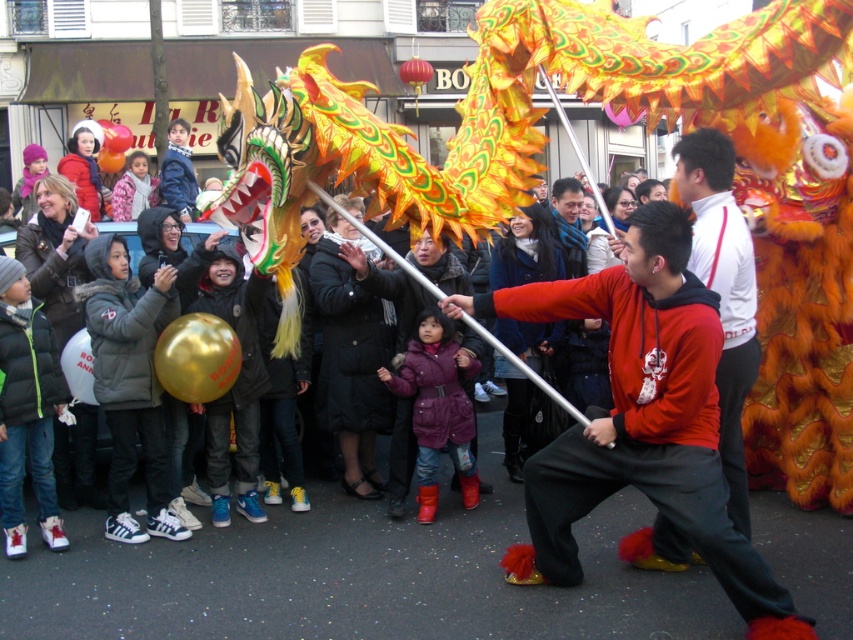
You are a photographer standing at the edge of the crowd, trying to capture a clear photo of the dragon. You notice two people in red clothing at the center of the scene. Which person, the one wearing the matte red sweatshirt at center or the red hoodie at center, is shorter and might allow you to get a better shot without blocking the dragon?

The matte red sweatshirt at center is shorter in height compared to the red hoodie at center, so the person wearing the matte red sweatshirt at center is shorter and might allow you to get a better shot without blocking the dragon.

You are a photographer standing at the edge of the crowd. You want to capture the dragon performance while ensuring the matte red sweatshirt at center is visible in the foreground. Based on its position, can you confirm if the sweatshirt is positioned in the lower half of your view?

The matte red sweatshirt at center is located at point [641,419]. Since the y coordinate 0.753 is above 0.5, it is in the upper half of the view, so it won t be in the lower half foreground.